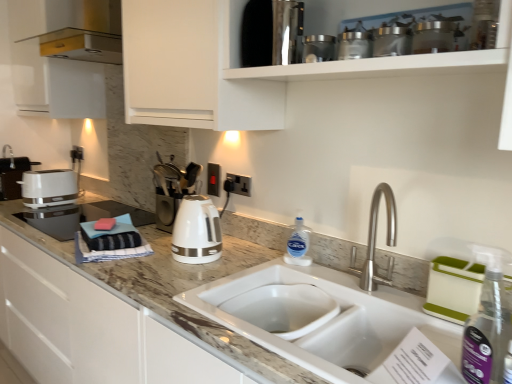
Find the location of `vacant area that is in front of clear plastic bottle at sink, marked as the second bottle in a front-to-back arrangement`. vacant area that is in front of clear plastic bottle at sink, marked as the second bottle in a front-to-back arrangement is located at coordinates (321, 278).